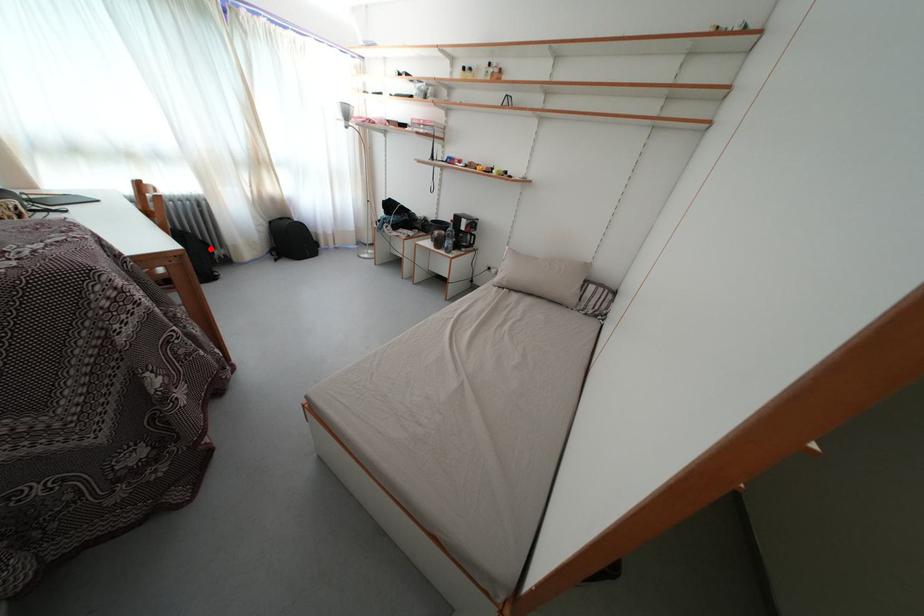
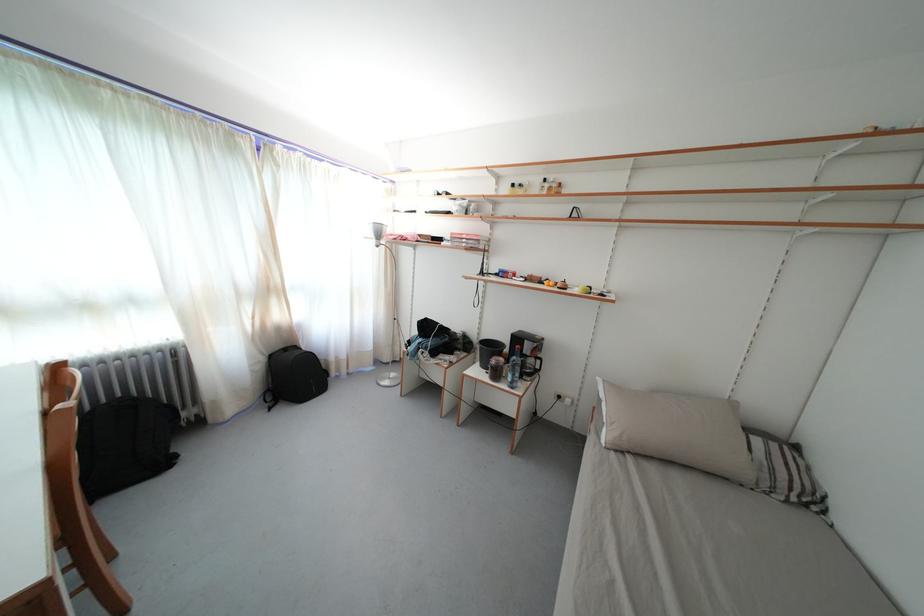
Question: I am providing you with two images of the same scene from different viewpoints. Image1 has a red point marked. In image2, the corresponding 3D location appears at what relative position? Reply with the corresponding letter.

Choices:
 (A) Closer
 (B) Farther

Answer: (B)